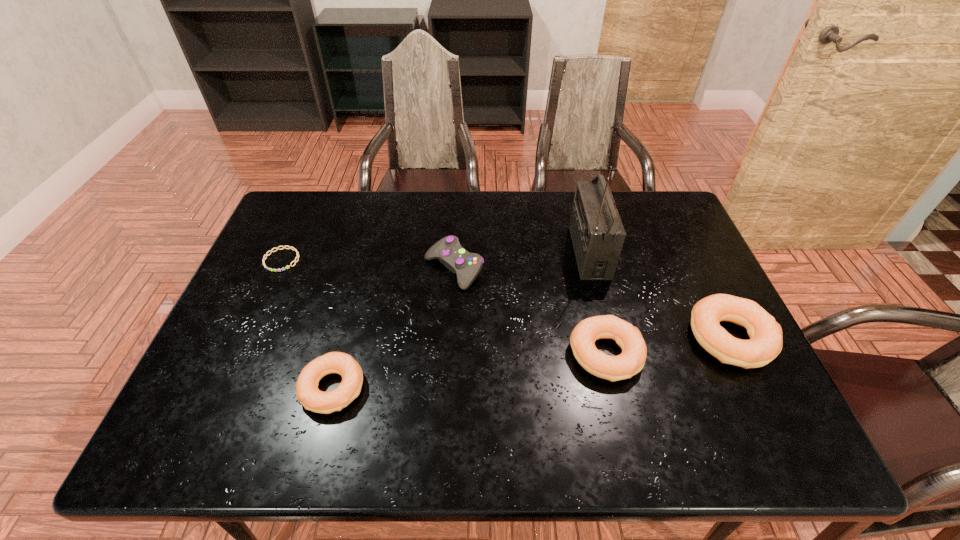
Identify the location of vacant space at the near edge. (532, 390).

Locate an element on the screen. The width and height of the screenshot is (960, 540). vacant space at the right edge of the desktop is located at coordinates click(x=697, y=268).

The height and width of the screenshot is (540, 960). I want to click on free space at the far left corner of the desktop, so click(287, 199).

Locate an element on the screen. The image size is (960, 540). empty space between the rightmost bagel and the leftmost object is located at coordinates (506, 299).

The image size is (960, 540). In order to click on empty space that is in between the shortest object and the rightmost bagel in this screenshot , I will do `click(506, 299)`.

Where is `free point between the bracelet and the rightmost bagel`? free point between the bracelet and the rightmost bagel is located at coordinates (506, 299).

The image size is (960, 540). What are the coordinates of `free space between the second tallest bagel and the fourth object from right to left` in the screenshot? It's located at (530, 312).

Locate an element on the screen. free spot between the rightmost object and the leftmost bagel is located at coordinates (532, 363).

Where is `vacant point located between the third object from left to right and the second tallest bagel`? This screenshot has width=960, height=540. vacant point located between the third object from left to right and the second tallest bagel is located at coordinates (530, 312).

You are a GUI agent. You are given a task and a screenshot of the screen. Output one action in this format:
    pyautogui.click(x=<x>, y=<y>)
    Task: Click on the free point between the second tallest bagel and the rightmost object
    
    Given the screenshot: What is the action you would take?
    pyautogui.click(x=668, y=346)